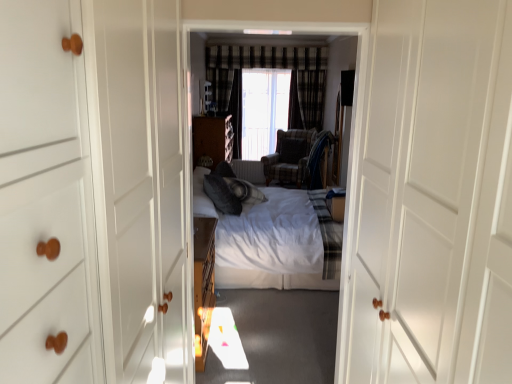
Question: Can you confirm if white wood door at center is bigger than transparent plastic window screen at center?

Choices:
 (A) yes
 (B) no

Answer: (A)

Question: Is white wood door at center behind transparent plastic window screen at center?

Choices:
 (A) no
 (B) yes

Answer: (A)

Question: Considering the relative sizes of white wood door at center and transparent plastic window screen at center in the image provided, is white wood door at center taller than transparent plastic window screen at center?

Choices:
 (A) no
 (B) yes

Answer: (B)

Question: Is white wood door at center at the left side of transparent plastic window screen at center?

Choices:
 (A) yes
 (B) no

Answer: (B)

Question: From the image's perspective, is white wood door at center on top of transparent plastic window screen at center?

Choices:
 (A) yes
 (B) no

Answer: (B)

Question: Is white soft bed at center to the left or to the right of white soft bed at center in the image?

Choices:
 (A) right
 (B) left

Answer: (A)

Question: From the image's perspective, is white soft bed at center above or below white soft bed at center?

Choices:
 (A) below
 (B) above

Answer: (B)

Question: Looking at the image, does white soft bed at center seem bigger or smaller compared to white soft bed at center?

Choices:
 (A) small
 (B) big

Answer: (B)

Question: From a real-world perspective, relative to white soft bed at center, is white soft bed at center vertically above or below?

Choices:
 (A) below
 (B) above

Answer: (A)

Question: Is white wood door at center in front of or behind white soft bed at center in the image?

Choices:
 (A) front
 (B) behind

Answer: (A)

Question: From a real-world perspective, is white wood door at center positioned above or below white soft bed at center?

Choices:
 (A) above
 (B) below

Answer: (A)

Question: Considering the positions of white wood door at center and white soft bed at center in the image, is white wood door at center taller or shorter than white soft bed at center?

Choices:
 (A) short
 (B) tall

Answer: (A)

Question: Do you think white wood door at center is within white soft bed at center, or outside of it?

Choices:
 (A) inside
 (B) outside

Answer: (B)

Question: Would you say plaid fabric curtain at center is to the left or to the right of white wood door at center in the picture?

Choices:
 (A) left
 (B) right

Answer: (B)

Question: Looking at their shapes, would you say plaid fabric curtain at center is wider or thinner than white wood door at center?

Choices:
 (A) thin
 (B) wide

Answer: (A)